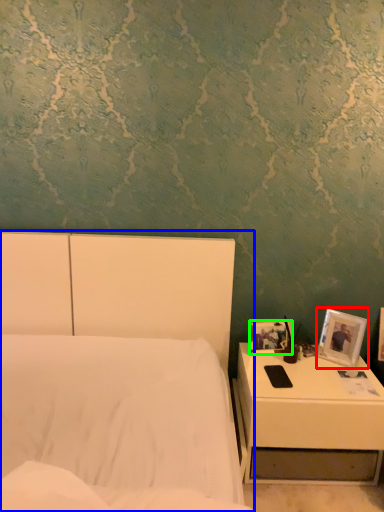
Question: Considering the real-world distances, which object is closest to picture frame (highlighted by a red box)? bed (highlighted by a blue box) or picture frame (highlighted by a green box).

Choices:
 (A) bed
 (B) picture frame

Answer: (B)